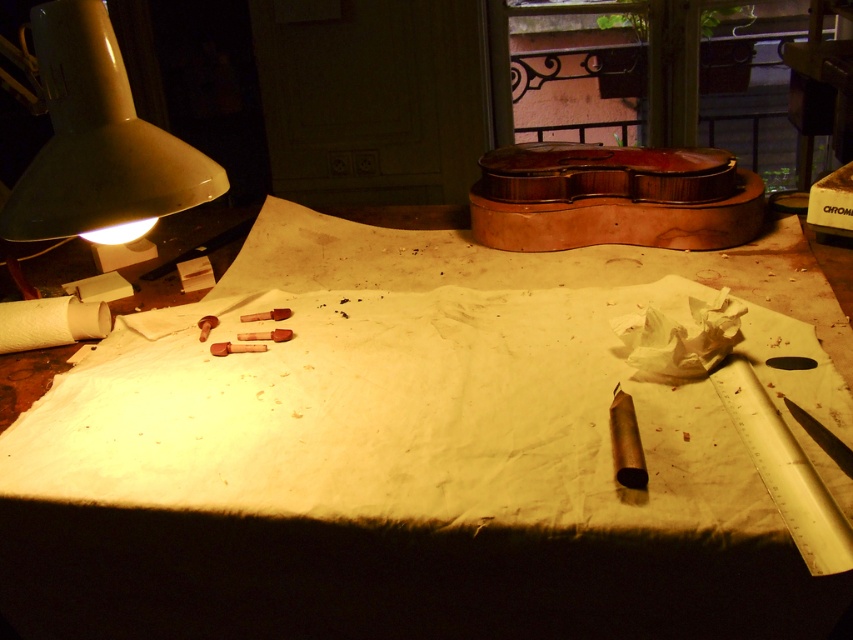
You are a worker who needs to place a new tool on the table. The tool requires a space of 32 inches between the matte white lamp at upper left and the nearest edge of the table. Can you fit the tool in this workspace?

The distance between the matte white lamp at upper left and the nearest edge of the table is 32.49 inches, which is slightly more than the required 32 inches. Therefore, the tool can be placed in this workspace.

You are organizing the items on the desk and need to stack the white paper at center and the white paper towel at lower left. Which one should you place at the bottom to ensure stability?

The white paper at center should be placed at the bottom since it has a greater height than the white paper towel at lower left, providing a more stable base.